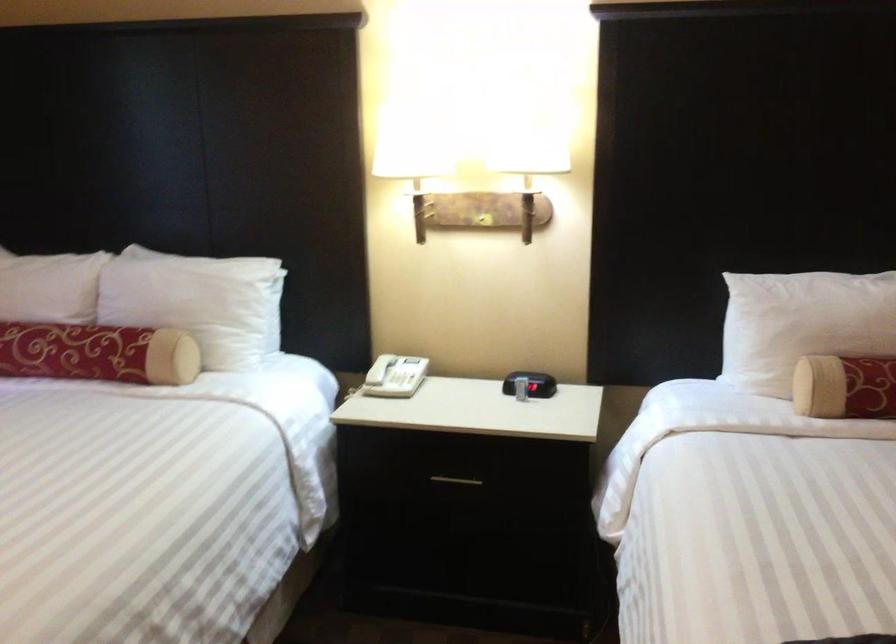
Where is `white telephone buttons`? This screenshot has height=644, width=896. white telephone buttons is located at coordinates (405, 380).